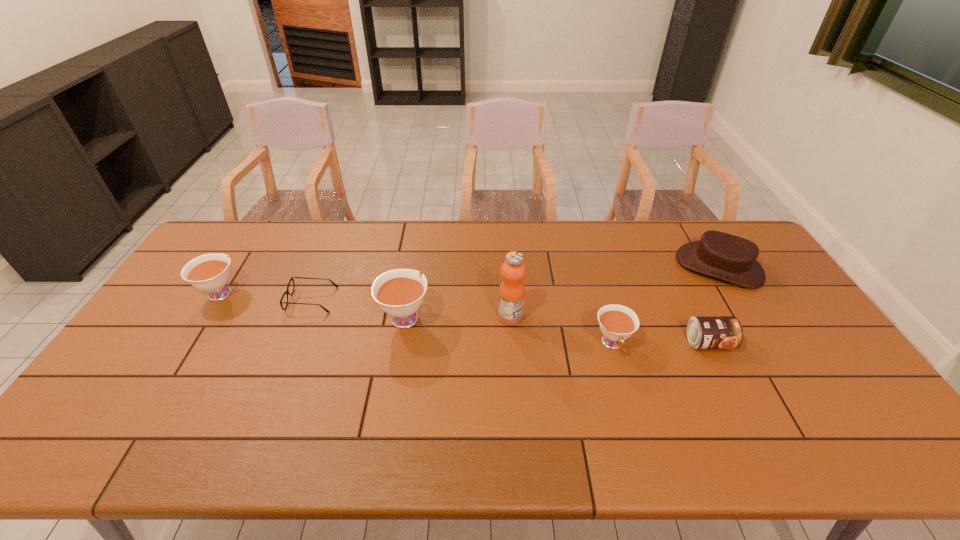
Identify the location of vacant space that's between the can and the second shortest teacup. (465, 317).

Locate an element on the screen. The image size is (960, 540). blank region between the rightmost teacup and the hat is located at coordinates (665, 305).

The width and height of the screenshot is (960, 540). In order to click on vacant point located between the fourth object from left to right and the rightmost teacup in this screenshot , I will do `click(562, 330)`.

You are a GUI agent. You are given a task and a screenshot of the screen. Output one action in this format:
    pyautogui.click(x=<x>, y=<y>)
    Task: Click on the blank region between the shortest teacup and the hat
    
    Given the screenshot: What is the action you would take?
    pyautogui.click(x=665, y=305)

Where is `free space between the fruit juice and the shortest teacup`? The image size is (960, 540). free space between the fruit juice and the shortest teacup is located at coordinates (562, 330).

Image resolution: width=960 pixels, height=540 pixels. Identify the location of vacant area between the second teacup from right to left and the shortest object. (358, 308).

Select which object appears as the second closest to the hat. Please provide its 2D coordinates. Your answer should be formatted as a tuple, i.e. [(x, y)], where the tuple contains the x and y coordinates of a point satisfying the conditions above.

[(617, 323)]

Point out which object is positioned as the second nearest to the second shortest teacup. Please provide its 2D coordinates. Your answer should be formatted as a tuple, i.e. [(x, y)], where the tuple contains the x and y coordinates of a point satisfying the conditions above.

[(399, 292)]

Locate an element on the screen. Image resolution: width=960 pixels, height=540 pixels. teacup that is the closest to the second teacup from left to right is located at coordinates (210, 272).

Locate an element on the screen. teacup identified as the closest to the can is located at coordinates coord(617,323).